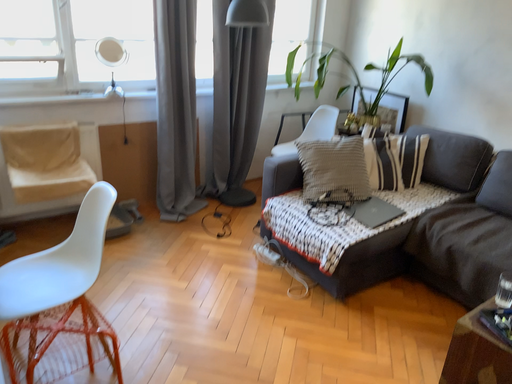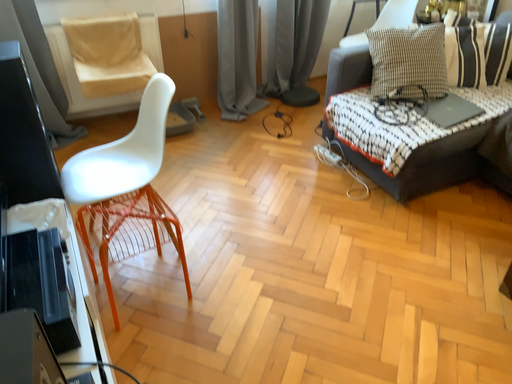
Question: How did the camera likely rotate when shooting the video?

Choices:
 (A) rotated left
 (B) rotated right

Answer: (A)